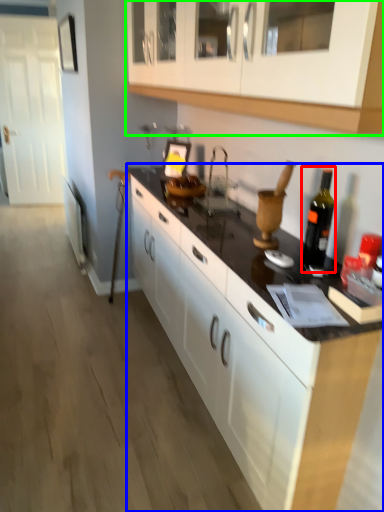
Question: Considering the real-world distances, which object is farthest from bottle (highlighted by a red box)? countertop (highlighted by a blue box) or cabinetry (highlighted by a green box)?

Choices:
 (A) countertop
 (B) cabinetry

Answer: (B)